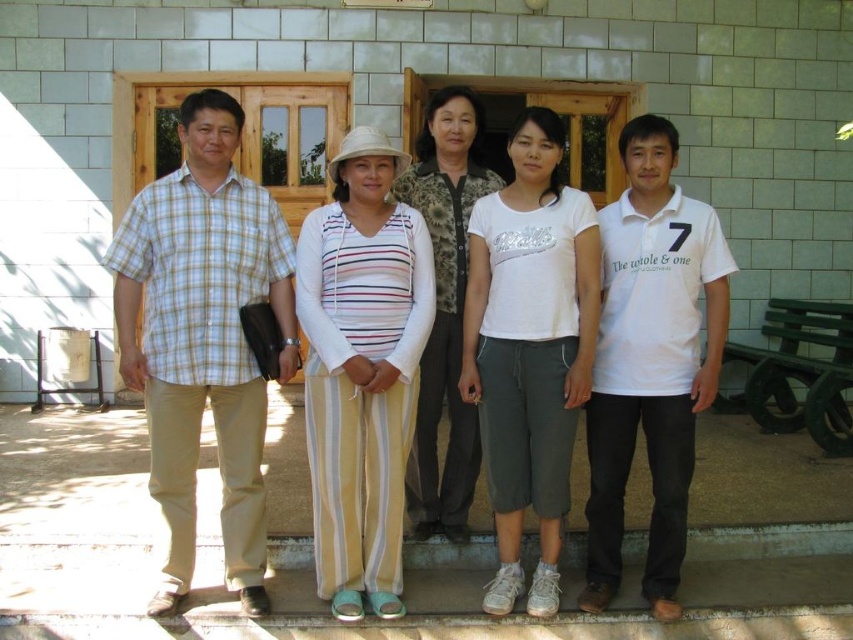
Based on the photo, you are a photographer trying to capture a group photo of the striped fabric top at center and the white cotton polo shirt at right. The camera you are using has a maximum focus range of 3 feet. Can you take a photo of both subjects without moving either of them?

The striped fabric top at center is 3.71 feet from the white cotton polo shirt at right. Since the camera has a maximum focus range of 3 feet, it cannot capture both subjects clearly without moving them closer.